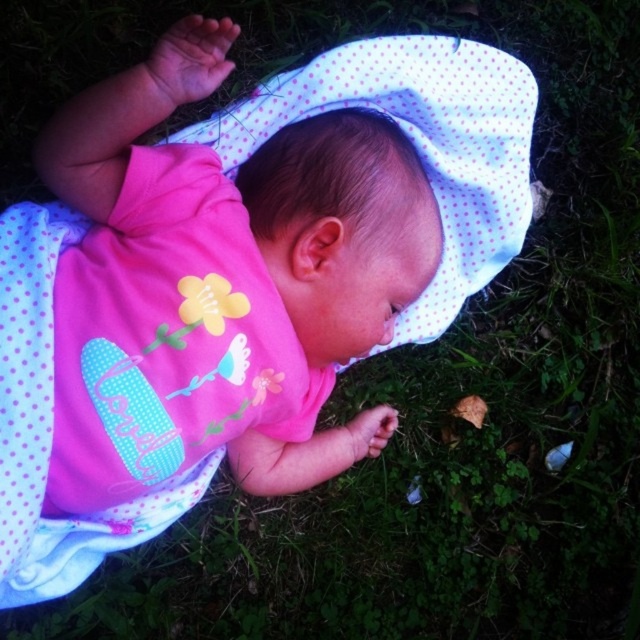
Question: Can you confirm if pink matte fabric baby at center is positioned to the right of white dotted fabric at center?

Choices:
 (A) yes
 (B) no

Answer: (B)

Question: Which point is farther to the camera?

Choices:
 (A) white dotted fabric at center
 (B) pink matte fabric baby at center

Answer: (A)

Question: Which object appears closest to the camera in this image?

Choices:
 (A) white dotted fabric at center
 (B) pink matte fabric baby at center

Answer: (B)

Question: Is pink matte fabric baby at center further to camera compared to white dotted fabric at center?

Choices:
 (A) no
 (B) yes

Answer: (A)

Question: Is pink matte fabric baby at center in front of white dotted fabric at center?

Choices:
 (A) yes
 (B) no

Answer: (A)